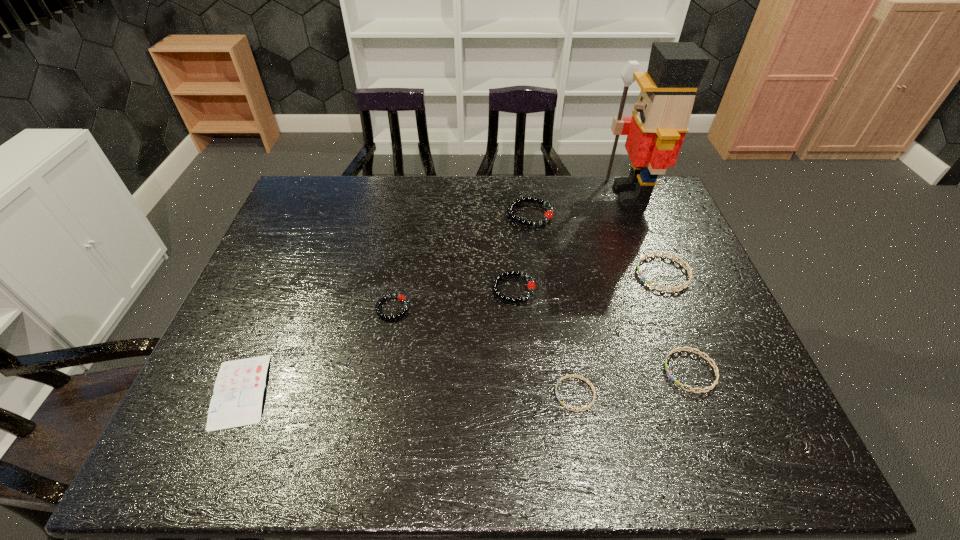
The width and height of the screenshot is (960, 540). What are the coordinates of `vacant point that satisfies the following two spatial constraints: 1. in front of the nutcracker holding the staff; 2. on the front side of the leftmost object` in the screenshot? It's located at (709, 391).